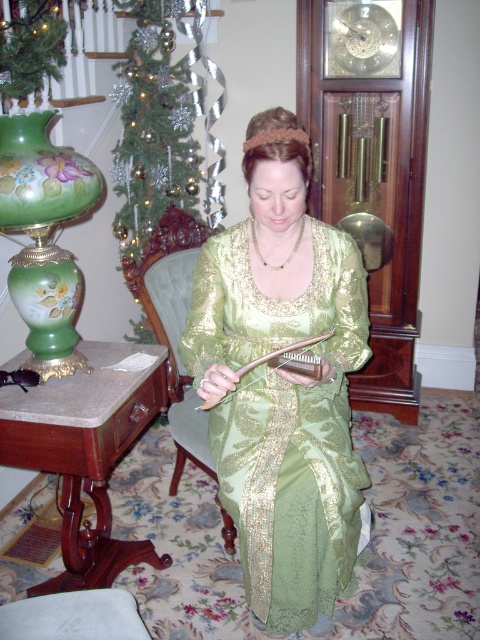
Question: Does green fabric armchair at center have a greater width compared to gold chain necklace at center?

Choices:
 (A) no
 (B) yes

Answer: (B)

Question: Is green satin dress at center above gold chain necklace at center?

Choices:
 (A) no
 (B) yes

Answer: (A)

Question: Which of the following is the closest to the observer?

Choices:
 (A) green satin dress at center
 (B) gold chain necklace at center
 (C) green fabric armchair at center

Answer: (A)

Question: Which point is farther to the camera?

Choices:
 (A) (192, 262)
 (B) (250, 428)
 (C) (273, 269)

Answer: (A)

Question: Does green satin dress at center appear on the right side of green fabric armchair at center?

Choices:
 (A) yes
 (B) no

Answer: (A)

Question: Which object appears farthest from the camera in this image?

Choices:
 (A) gold chain necklace at center
 (B) green satin dress at center

Answer: (A)